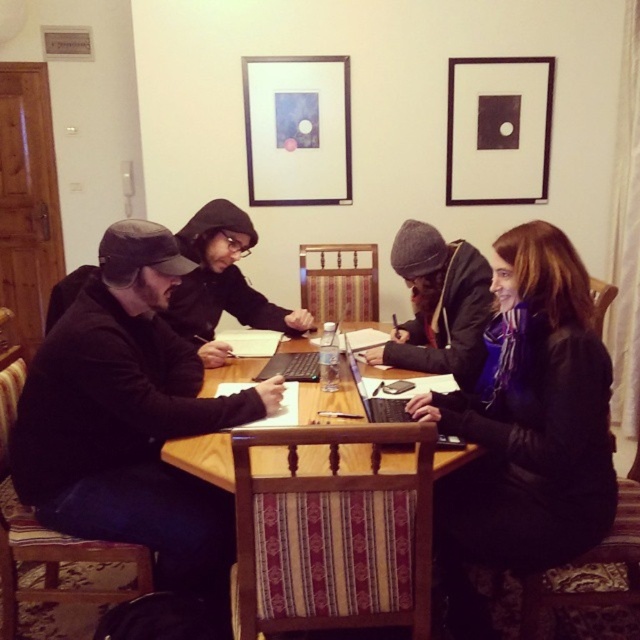
You are standing at the origin of the coordinate system in the image. There are two points marked in the scene. Which point is closer to you, point (586, 468) or point (305, 544)?

Point (305, 544) is closer to you because it is in front of point (586, 468).

In the scene shown: You are standing 2 meters away from the wooden table in the image. There is a point at coordinates point (493,280) on the table. Can you reach this point without moving closer to the table?

The distance of point (493,280) from viewer is 1.85 meters. Since you are standing 2 meters away from the table, the point is closer than your current position. You can reach it without moving closer.